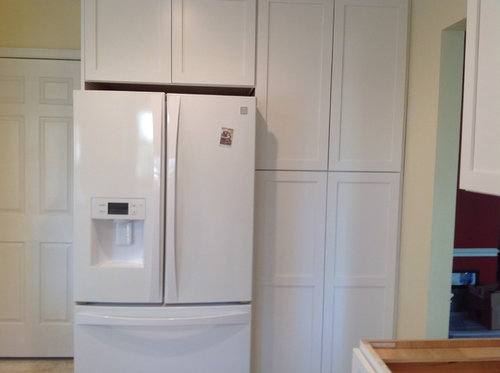
Locate an element on the screen. water dispenser is located at coordinates (123, 235).